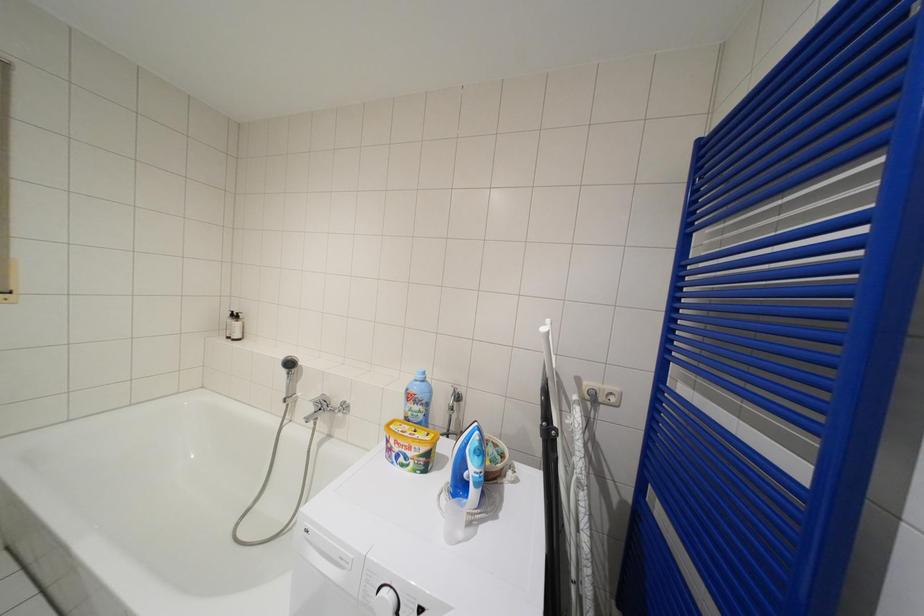
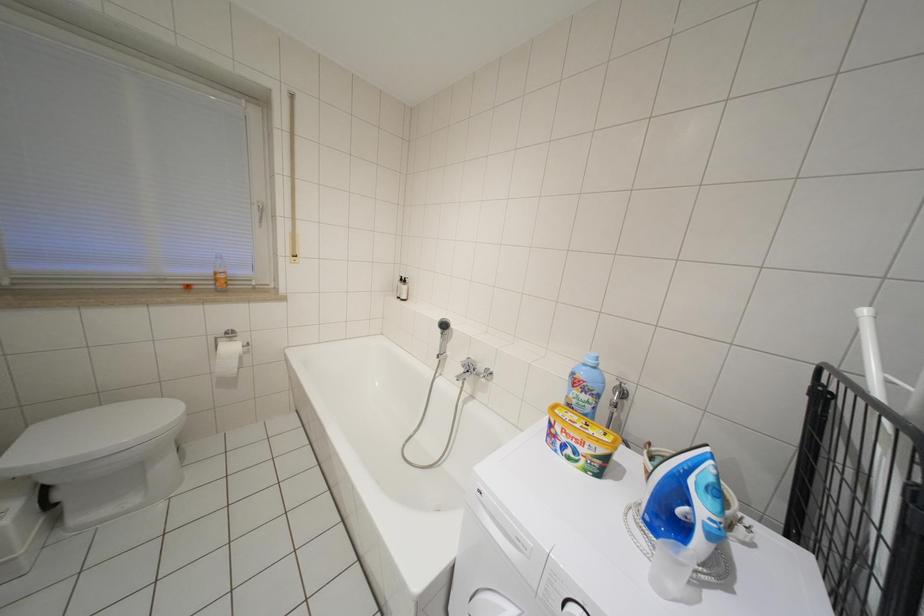
What movement of the cameraman would produce the second image?

The cameraman walked toward left, forward.